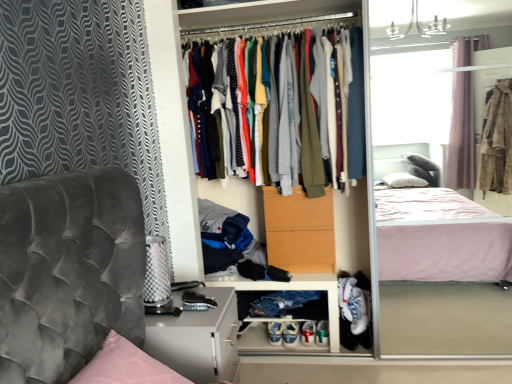
Image resolution: width=512 pixels, height=384 pixels. Identify the location of free point in front of white leather sneakers at lower center, positioned as the first footwear in right-to-left order. (293, 355).